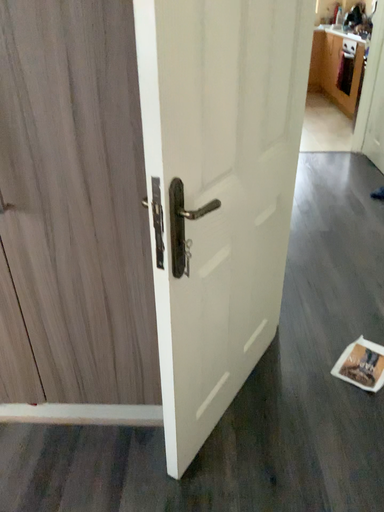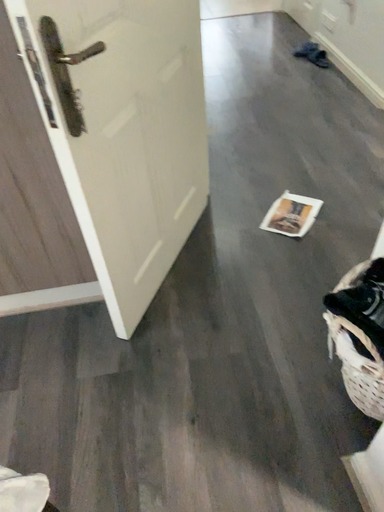
Question: Which way did the camera rotate in the video?

Choices:
 (A) rotated downward
 (B) rotated upward

Answer: (A)